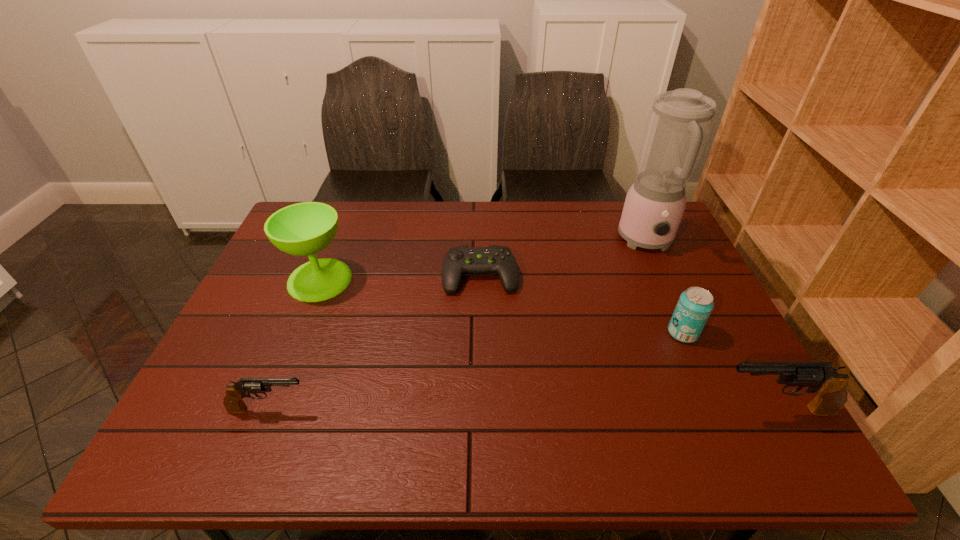
Identify the location of vacant region located 0.370m along the barrel of the right gun. The image size is (960, 540). (541, 410).

Locate an element on the screen. Image resolution: width=960 pixels, height=540 pixels. blank space located along the barrel of the right gun is located at coordinates (652, 410).

This screenshot has width=960, height=540. Identify the location of free space located 0.390m along the barrel of the right gun. point(532,410).

The height and width of the screenshot is (540, 960). What are the coordinates of `free space located 0.230m on the base of the food processor near the control knob` in the screenshot? It's located at (684, 321).

The width and height of the screenshot is (960, 540). Identify the location of free spot located 0.120m on the front of the fifth shortest object. (298, 336).

At what (x,y) coordinates should I click in order to perform the action: click on vacant space located on the front of the third object from left to right. Please return your answer as a coordinate pair (x, y). The height and width of the screenshot is (540, 960). Looking at the image, I should click on (480, 342).

Find the location of a particular element. The height and width of the screenshot is (540, 960). blank space located on the front of the beer can is located at coordinates (717, 410).

In order to click on object present at the far edge in this screenshot , I will do `click(679, 122)`.

Identify the location of gun that is at the left edge. This screenshot has width=960, height=540. (233, 402).

Image resolution: width=960 pixels, height=540 pixels. I want to click on wineglass at the left edge, so click(303, 229).